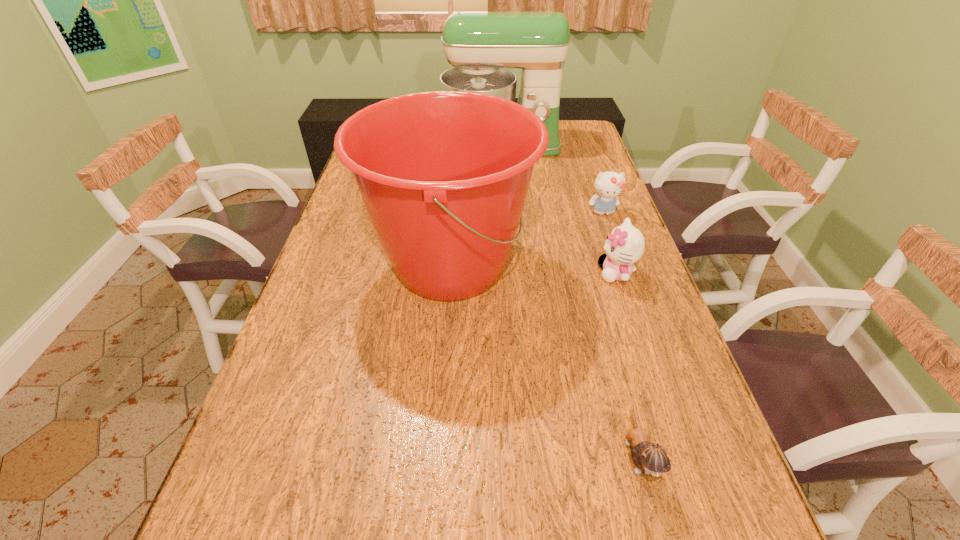
Image resolution: width=960 pixels, height=540 pixels. Find the location of `vacant area between the second tallest object and the second nearest kitten`. vacant area between the second tallest object and the second nearest kitten is located at coordinates (533, 269).

In order to click on vacant space that is in between the shortest kitten and the bucket in this screenshot , I will do 543,360.

This screenshot has height=540, width=960. I want to click on vacant region between the shortest object and the farthest object, so click(569, 300).

Locate an element on the screen. This screenshot has width=960, height=540. unoccupied area between the farthest object and the nearest kitten is located at coordinates (569, 300).

Where is `vacant point located between the nearest object and the second nearest kitten`? This screenshot has width=960, height=540. vacant point located between the nearest object and the second nearest kitten is located at coordinates (627, 364).

Where is `vacant space that's between the nearest kitten and the second nearest kitten`? vacant space that's between the nearest kitten and the second nearest kitten is located at coordinates (627, 364).

The image size is (960, 540). What are the coordinates of `vacant space in between the second nearest kitten and the shortest kitten` in the screenshot? It's located at point(627,364).

Find the location of `free area in between the second tallest object and the second nearest kitten`. free area in between the second tallest object and the second nearest kitten is located at coordinates (533, 269).

You are a GUI agent. You are given a task and a screenshot of the screen. Output one action in this format:
    pyautogui.click(x=<x>, y=<y>)
    Task: Click on the blank region between the second tallest object and the farthest kitten
    The height and width of the screenshot is (540, 960).
    Given the screenshot: What is the action you would take?
    pyautogui.click(x=527, y=239)

You are a GUI agent. You are given a task and a screenshot of the screen. Output one action in this format:
    pyautogui.click(x=<x>, y=<y>)
    Task: Click on the free space between the farthest kitten and the mixer
    Image resolution: width=960 pixels, height=540 pixels.
    Given the screenshot: What is the action you would take?
    pyautogui.click(x=552, y=179)